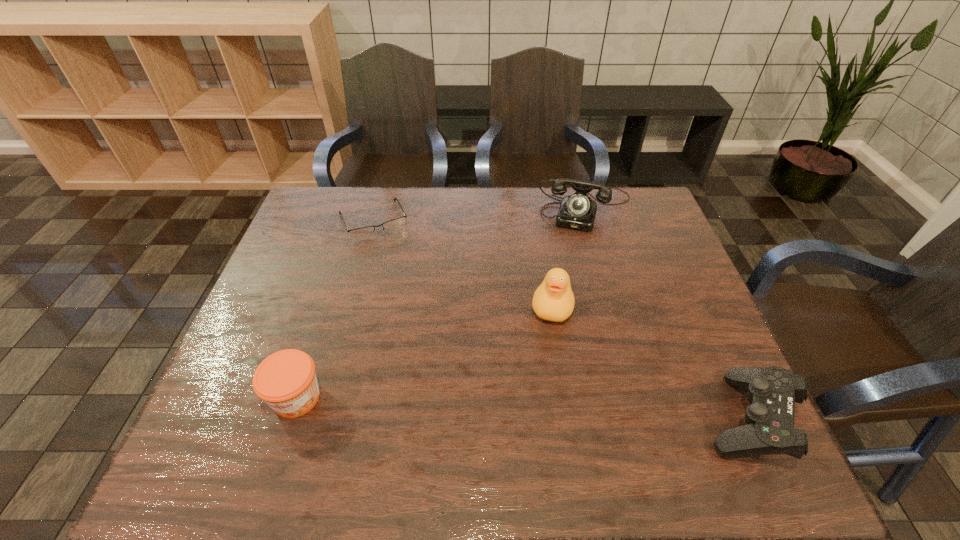
Where is `blank space at the left edge of the desktop`? The image size is (960, 540). blank space at the left edge of the desktop is located at coordinates (305, 239).

In the image, there is a desktop. Where is `vacant space at the right edge`? Image resolution: width=960 pixels, height=540 pixels. vacant space at the right edge is located at coordinates (650, 325).

Locate an element on the screen. vacant space at the far left corner of the desktop is located at coordinates (329, 219).

Locate an element on the screen. Image resolution: width=960 pixels, height=540 pixels. free space at the near right corner is located at coordinates point(684,402).

You are a GUI agent. You are given a task and a screenshot of the screen. Output one action in this format:
    pyautogui.click(x=<x>, y=<y>)
    Task: Click on the empty location between the jam and the control
    
    Given the screenshot: What is the action you would take?
    pyautogui.click(x=522, y=408)

Locate an element on the screen. This screenshot has width=960, height=540. blank region between the telephone and the duck is located at coordinates (569, 256).

You are a GUI agent. You are given a task and a screenshot of the screen. Output one action in this format:
    pyautogui.click(x=<x>, y=<y>)
    Task: Click on the vacant point located between the control and the jam
    
    Given the screenshot: What is the action you would take?
    pyautogui.click(x=522, y=408)

What are the coordinates of `vacant area that lies between the tallest object and the control` in the screenshot? It's located at (650, 362).

I want to click on free space between the duck and the jam, so 424,351.

At what (x,y) coordinates should I click in order to perform the action: click on empty space between the duck and the shortest object. Please return your answer as a coordinate pair (x, y). Image resolution: width=960 pixels, height=540 pixels. Looking at the image, I should click on (463, 263).